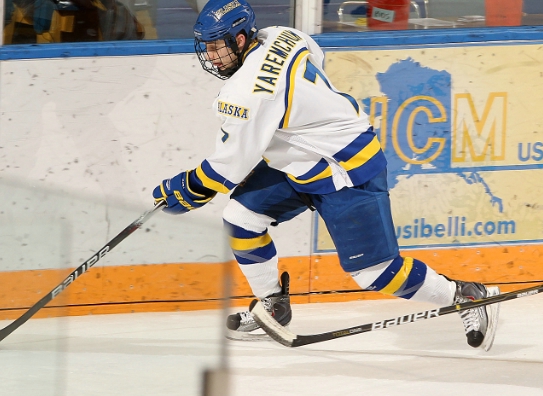
You are a GUI agent. You are given a task and a screenshot of the screen. Output one action in this format:
    pyautogui.click(x=<x>, y=<y>)
    Task: Click on the white wall
    
    Given the screenshot: What is the action you would take?
    pyautogui.click(x=59, y=125), pyautogui.click(x=59, y=193)